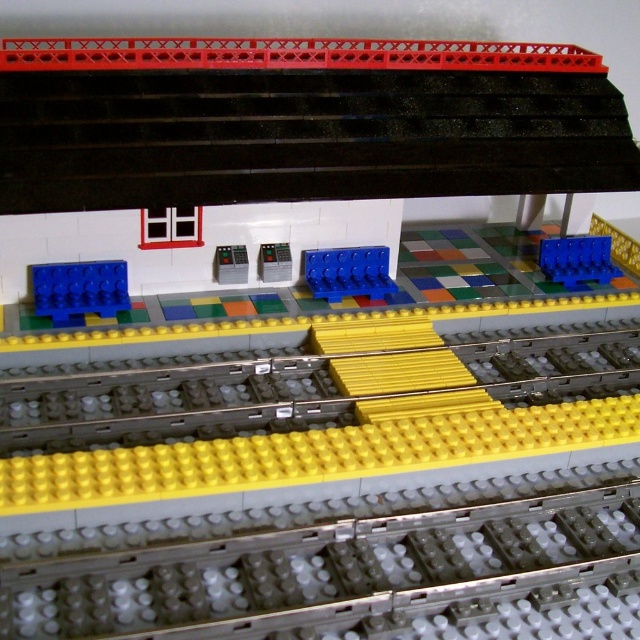
Question: Is blue matte brick at left in front of blue matte brick at center?

Choices:
 (A) yes
 (B) no

Answer: (A)

Question: Among these points, which one is farthest from the camera?

Choices:
 (A) (61, 289)
 (B) (225, 268)
 (C) (307, 276)

Answer: (C)

Question: Does blue matte brick at left have a larger size compared to metallic gray control panel at center?

Choices:
 (A) yes
 (B) no

Answer: (A)

Question: Estimate the real-world distances between objects in this image. Which object is farther from the blue matte brick at center?

Choices:
 (A) metallic gray control panel at center
 (B) blue matte brick at left

Answer: (B)

Question: Which object is closer to the camera taking this photo?

Choices:
 (A) blue matte brick at center
 (B) blue matte brick at left

Answer: (B)

Question: In this image, where is blue matte brick at left located relative to metallic gray control panel at center?

Choices:
 (A) below
 (B) above

Answer: (A)